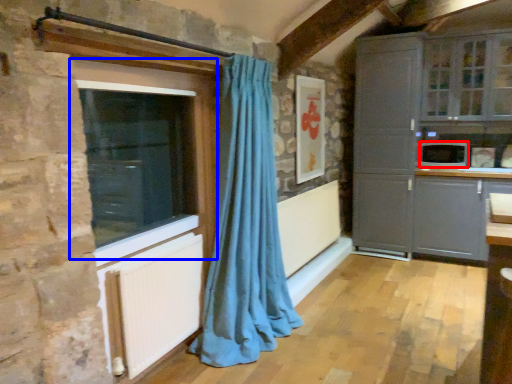
Question: Which point is further to the camera, appliance (highlighted by a red box) or window (highlighted by a blue box)?

Choices:
 (A) appliance
 (B) window

Answer: (A)